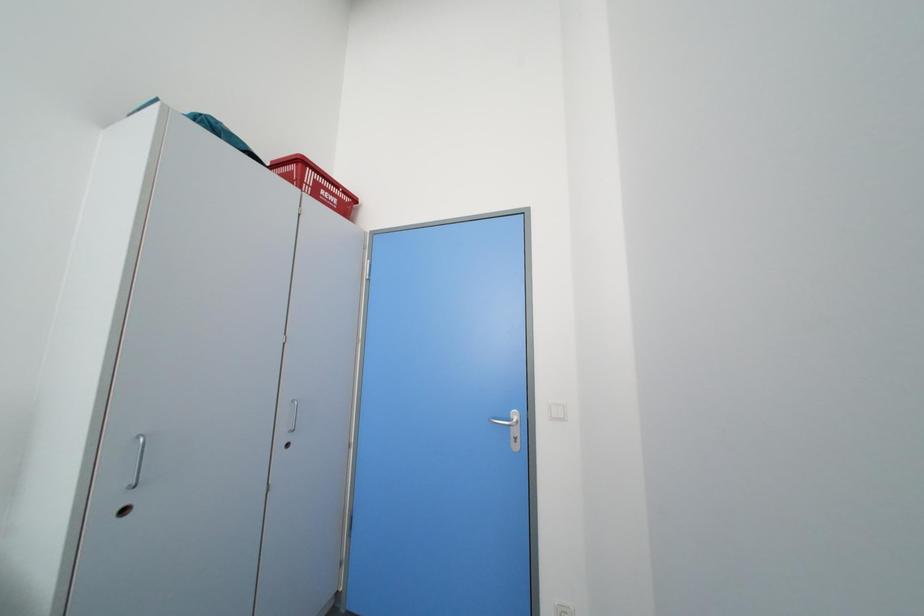
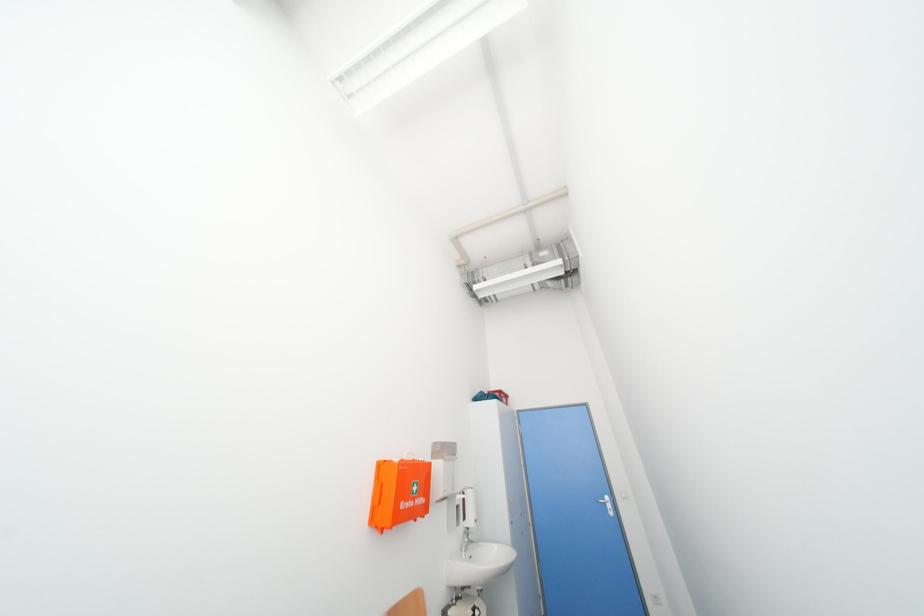
The images are taken continuously from a first-person perspective. In which direction are you moving?

The movement direction of the cameraman is left, backward.